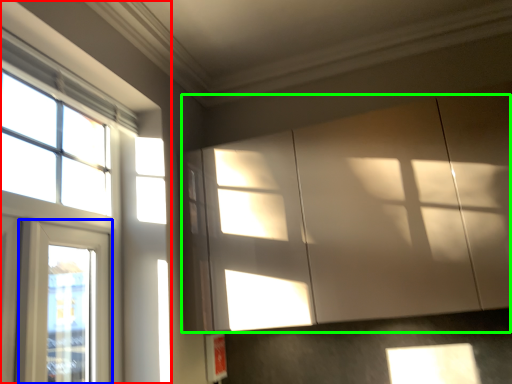
Question: Based on their relative distances, which object is farther from window (highlighted by a red box)? Choose from window (highlighted by a blue box) and cabinetry (highlighted by a green box).

Choices:
 (A) window
 (B) cabinetry

Answer: (B)